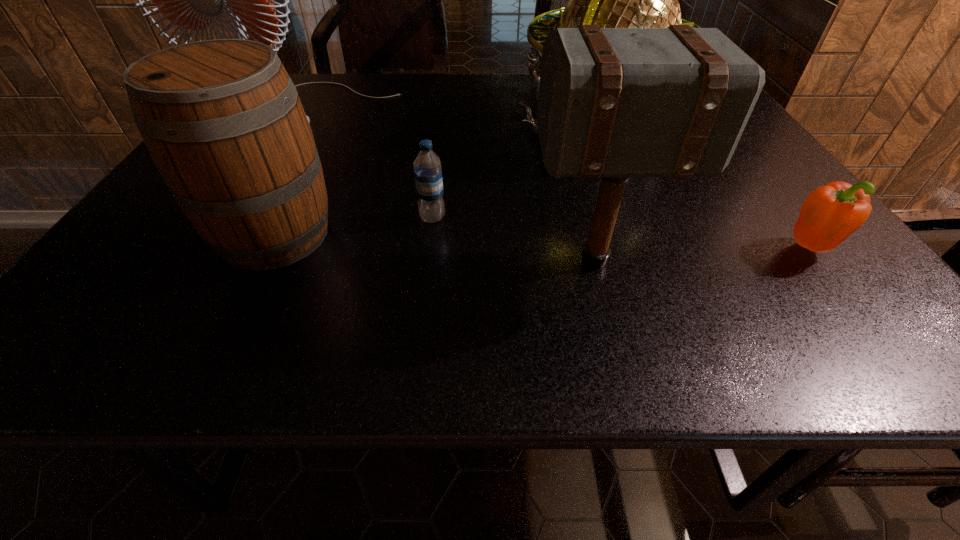
This screenshot has width=960, height=540. Identify the location of fan. (192, 0).

Identify the location of globe. Image resolution: width=960 pixels, height=540 pixels. (613, 0).

In order to click on mallet in this screenshot , I will do `click(616, 103)`.

Locate an element on the screen. Image resolution: width=960 pixels, height=540 pixels. the third shortest object is located at coordinates (222, 120).

The height and width of the screenshot is (540, 960). I want to click on the fourth object from right to left, so click(427, 168).

This screenshot has width=960, height=540. Find the location of `the rightmost object`. the rightmost object is located at coordinates (831, 213).

Identify the location of free space located on the front-facing side of the fan. This screenshot has width=960, height=540. (252, 225).

I want to click on free space located 0.200m on the front of the globe, so pos(637,237).

Locate an element on the screen. vacant region located on the striking surface of the mallet is located at coordinates (335, 261).

The height and width of the screenshot is (540, 960). In order to click on free space located on the striking surface of the mallet in this screenshot , I will do `click(431, 261)`.